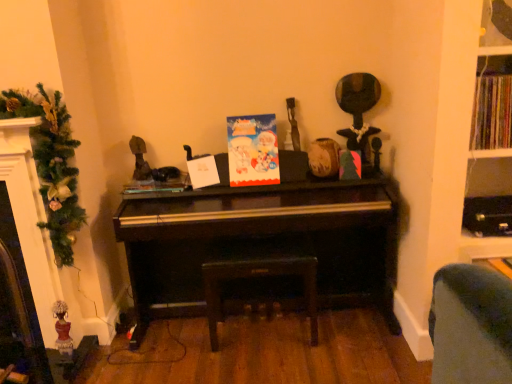
Question: Does green textured garland at left appear on the right side of shiny black piano at center?

Choices:
 (A) yes
 (B) no

Answer: (B)

Question: Can you confirm if green textured garland at left is bigger than shiny black piano at center?

Choices:
 (A) no
 (B) yes

Answer: (A)

Question: Can you see green textured garland at left touching shiny black piano at center?

Choices:
 (A) no
 (B) yes

Answer: (A)

Question: Considering the relative sizes of green textured garland at left and shiny black piano at center in the image provided, is green textured garland at left taller than shiny black piano at center?

Choices:
 (A) no
 (B) yes

Answer: (A)

Question: Is shiny black piano at center surrounded by green textured garland at left?

Choices:
 (A) yes
 (B) no

Answer: (B)

Question: Considering the positions of shiny black piano at center and matte paper card at center in the image, is shiny black piano at center wider or thinner than matte paper card at center?

Choices:
 (A) wide
 (B) thin

Answer: (A)

Question: Does point (195, 228) appear closer or farther from the camera than point (237, 120)?

Choices:
 (A) closer
 (B) farther

Answer: (A)

Question: Looking at the image, does shiny black piano at center seem bigger or smaller compared to matte paper card at center?

Choices:
 (A) small
 (B) big

Answer: (B)

Question: Do you think shiny black piano at center is within matte paper card at center, or outside of it?

Choices:
 (A) inside
 (B) outside

Answer: (B)

Question: Looking at their shapes, would you say green textured garland at left is wider or thinner than shiny black piano at center?

Choices:
 (A) wide
 (B) thin

Answer: (B)

Question: In terms of size, does green textured garland at left appear bigger or smaller than shiny black piano at center?

Choices:
 (A) big
 (B) small

Answer: (B)

Question: Is green textured garland at left taller or shorter than shiny black piano at center?

Choices:
 (A) short
 (B) tall

Answer: (A)

Question: Is green textured garland at left in front of or behind shiny black piano at center in the image?

Choices:
 (A) behind
 (B) front

Answer: (B)

Question: Is leather-like dark brown stool at center taller or shorter than shiny black piano at center?

Choices:
 (A) short
 (B) tall

Answer: (A)

Question: Based on their sizes in the image, would you say leather-like dark brown stool at center is bigger or smaller than shiny black piano at center?

Choices:
 (A) big
 (B) small

Answer: (B)